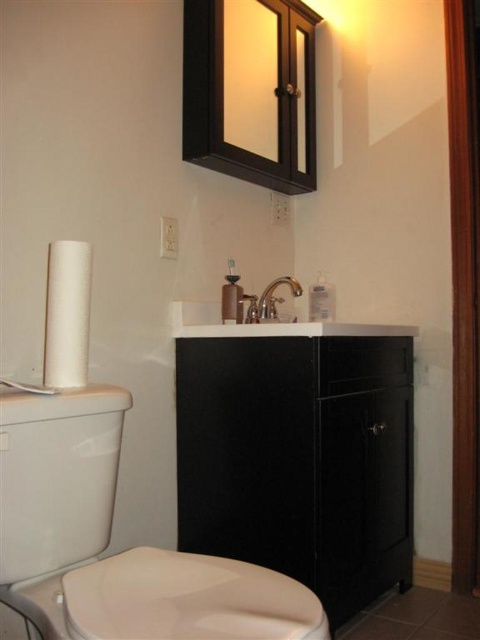
Question: Does satin nickel faucet at center lie behind white glossy sink at center?

Choices:
 (A) no
 (B) yes

Answer: (A)

Question: Which is nearer to the white glossy toilet bowl at left?

Choices:
 (A) satin nickel faucet at center
 (B) white glossy sink at center
 (C) silver metallic faucet at center

Answer: (A)

Question: Which object is farther from the camera taking this photo?

Choices:
 (A) satin nickel faucet at center
 (B) white glossy toilet bowl at left

Answer: (A)

Question: Can you confirm if silver metallic faucet at center is positioned below white glossy sink at center?

Choices:
 (A) no
 (B) yes

Answer: (A)

Question: Does white matte toilet paper at left have a lesser width compared to silver metallic faucet at center?

Choices:
 (A) yes
 (B) no

Answer: (A)

Question: Which of the following is the farthest from the observer?

Choices:
 (A) white glossy sink at center
 (B) satin nickel faucet at center
 (C) white glossy toilet bowl at left
 (D) white matte toilet paper at left

Answer: (A)